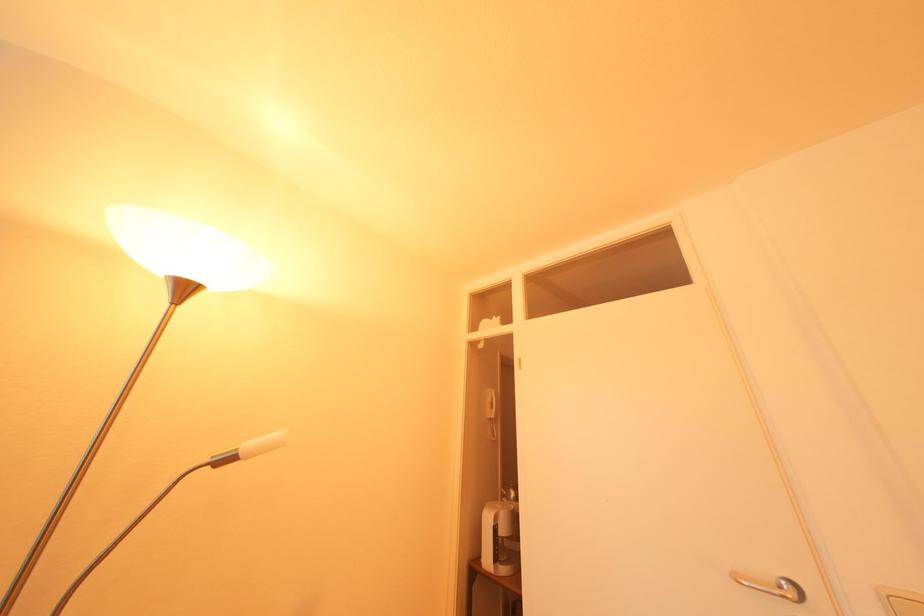
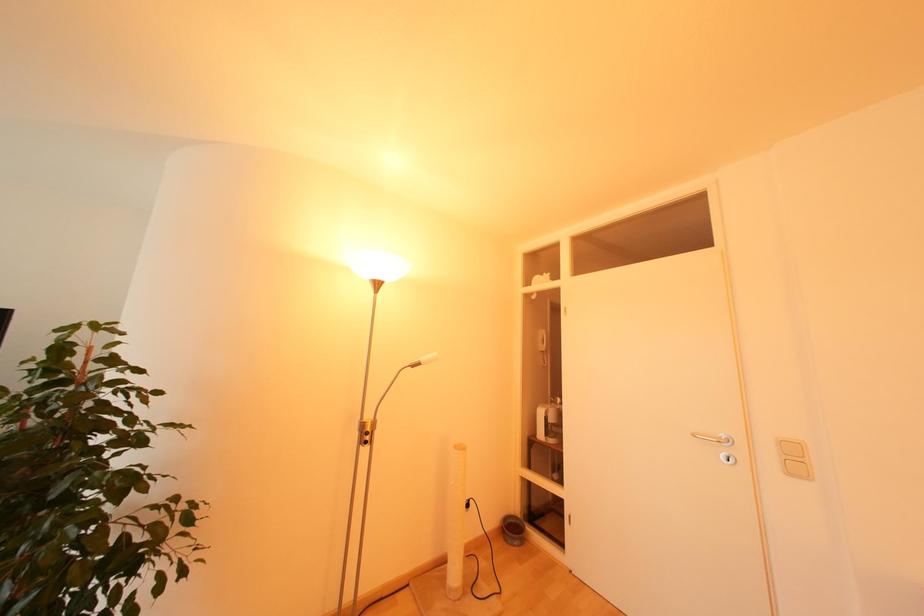
Question: What movement of the cameraman would produce the second image?

Choices:
 (A) Left
 (B) Right
 (C) Forward
 (D) Backward

Answer: (D)